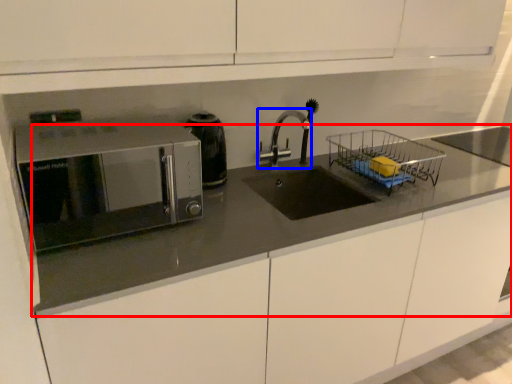
Question: Which object appears closest to the camera in this image, countertop (highlighted by a red box) or tap (highlighted by a blue box)?

Choices:
 (A) countertop
 (B) tap

Answer: (A)